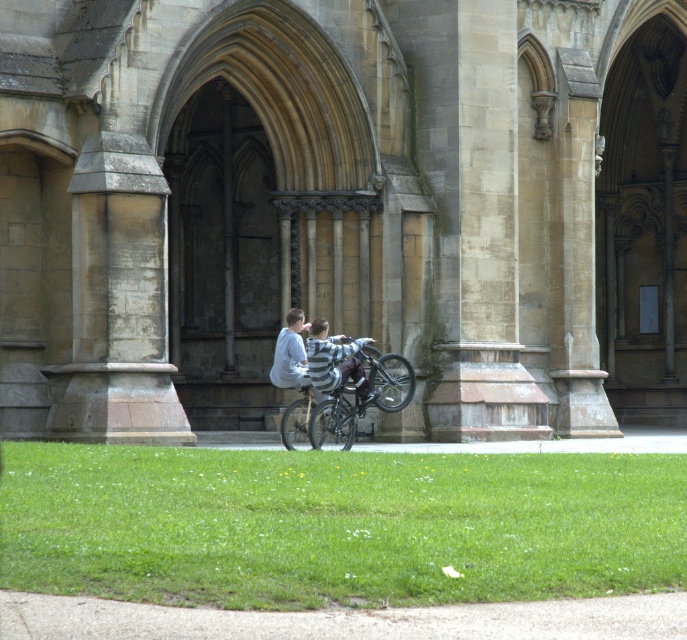
Which is above, stone church at center or shiny metallic bicycle at center?

Positioned higher is stone church at center.

Which is more to the left, stone church at center or shiny metallic bicycle at center?

Positioned to the left is shiny metallic bicycle at center.

Where is `stone church at center`? The image size is (687, 640). stone church at center is located at coordinates (341, 209).

Find the location of a particular element. stone church at center is located at coordinates (341, 209).

Can you confirm if stone church at center is positioned above green grass at lower center?

Yes.

Is point (348, 92) more distant than point (611, 588)?

Yes.

In order to click on stone church at center in this screenshot , I will do point(341,209).

The width and height of the screenshot is (687, 640). Describe the element at coordinates (337, 525) in the screenshot. I see `green grass at lower center` at that location.

Between green grass at lower center and shiny metallic bicycle at center, which one has less height?

Standing shorter between the two is shiny metallic bicycle at center.

Image resolution: width=687 pixels, height=640 pixels. In order to click on green grass at lower center in this screenshot , I will do `click(337, 525)`.

The height and width of the screenshot is (640, 687). What are the coordinates of `green grass at lower center` in the screenshot? It's located at (337, 525).